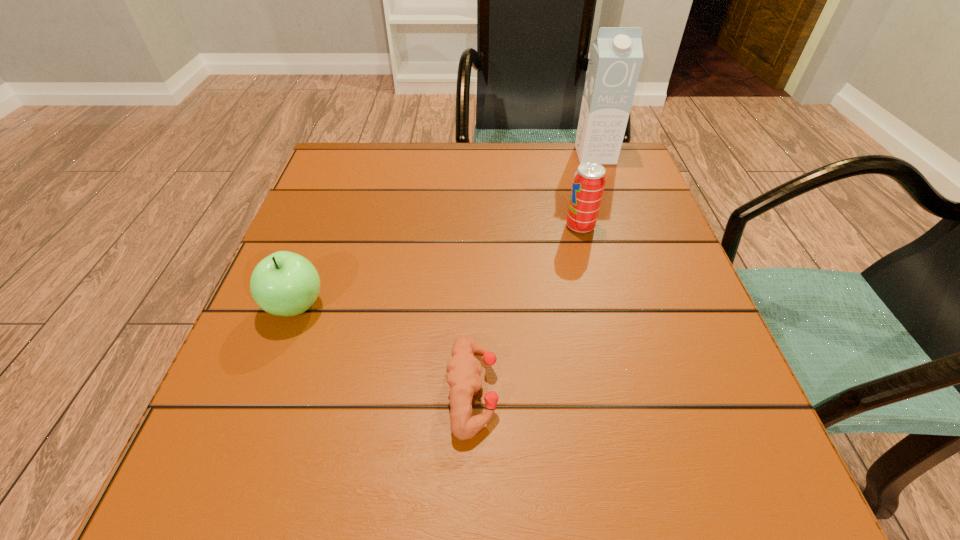
This screenshot has height=540, width=960. In order to click on carton in this screenshot , I will do `click(616, 56)`.

Identify the location of the farthest object. (616, 56).

Identify the location of the second tallest object. The height and width of the screenshot is (540, 960). (589, 180).

Locate an element on the screen. the second farthest object is located at coordinates (589, 180).

At what (x,y) coordinates should I click in order to perform the action: click on the second shortest object. Please return your answer as a coordinate pair (x, y). This screenshot has height=540, width=960. Looking at the image, I should click on (284, 283).

This screenshot has height=540, width=960. I want to click on apple, so click(x=284, y=283).

Identify the location of the nearest object. (463, 370).

Where is `the second object from left to right`? The width and height of the screenshot is (960, 540). the second object from left to right is located at coordinates (463, 370).

You are a GUI agent. You are given a task and a screenshot of the screen. Output one action in this format:
    pyautogui.click(x=<x>, y=<y>)
    Task: Click on the vacant area situated on the front label of the rightmost object
    The image size is (960, 540).
    Given the screenshot: What is the action you would take?
    pyautogui.click(x=633, y=264)

You are a GUI agent. You are given a task and a screenshot of the screen. Output one action in this format:
    pyautogui.click(x=<x>, y=<y>)
    Task: Click on the vacant space situated 0.320m on the left of the second farthest object
    
    Given the screenshot: What is the action you would take?
    pyautogui.click(x=408, y=226)